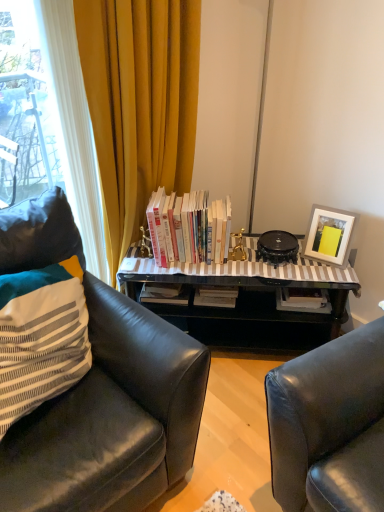
Question: Considering the relative positions of white matte picture frame at upper right and black leather chair at left in the image provided, is white matte picture frame at upper right to the left of black leather chair at left from the viewer's perspective?

Choices:
 (A) yes
 (B) no

Answer: (B)

Question: Is the depth of white matte picture frame at upper right less than that of black leather chair at left?

Choices:
 (A) no
 (B) yes

Answer: (A)

Question: Is white matte picture frame at upper right not near black leather chair at left?

Choices:
 (A) no
 (B) yes

Answer: (B)

Question: Considering the relative sizes of white matte picture frame at upper right and black leather chair at left in the image provided, is white matte picture frame at upper right thinner than black leather chair at left?

Choices:
 (A) yes
 (B) no

Answer: (A)

Question: Does white matte picture frame at upper right have a larger size compared to black leather chair at left?

Choices:
 (A) yes
 (B) no

Answer: (B)

Question: Relative to white paperbacks at center, is white matte picture frame at upper right in front or behind?

Choices:
 (A) front
 (B) behind

Answer: (A)

Question: In terms of height, does white matte picture frame at upper right look taller or shorter compared to white paperbacks at center?

Choices:
 (A) short
 (B) tall

Answer: (A)

Question: From a real-world perspective, is white matte picture frame at upper right above or below white paperbacks at center?

Choices:
 (A) below
 (B) above

Answer: (A)

Question: Based on their sizes in the image, would you say white matte picture frame at upper right is bigger or smaller than white paperbacks at center?

Choices:
 (A) small
 (B) big

Answer: (A)

Question: In terms of height, does striped fabric pillow at left look taller or shorter compared to black glass table at center?

Choices:
 (A) short
 (B) tall

Answer: (A)

Question: Is point (76, 369) positioned closer to the camera than point (231, 261)?

Choices:
 (A) farther
 (B) closer

Answer: (B)

Question: Based on their positions, is striped fabric pillow at left located to the left or right of black glass table at center?

Choices:
 (A) left
 (B) right

Answer: (A)

Question: From a real-world perspective, is striped fabric pillow at left above or below black glass table at center?

Choices:
 (A) above
 (B) below

Answer: (A)

Question: Is point (223, 226) closer or farther from the camera than point (3, 333)?

Choices:
 (A) farther
 (B) closer

Answer: (A)

Question: In the image, is white paperbacks at center positioned in front of or behind striped fabric pillow at left?

Choices:
 (A) front
 (B) behind

Answer: (B)